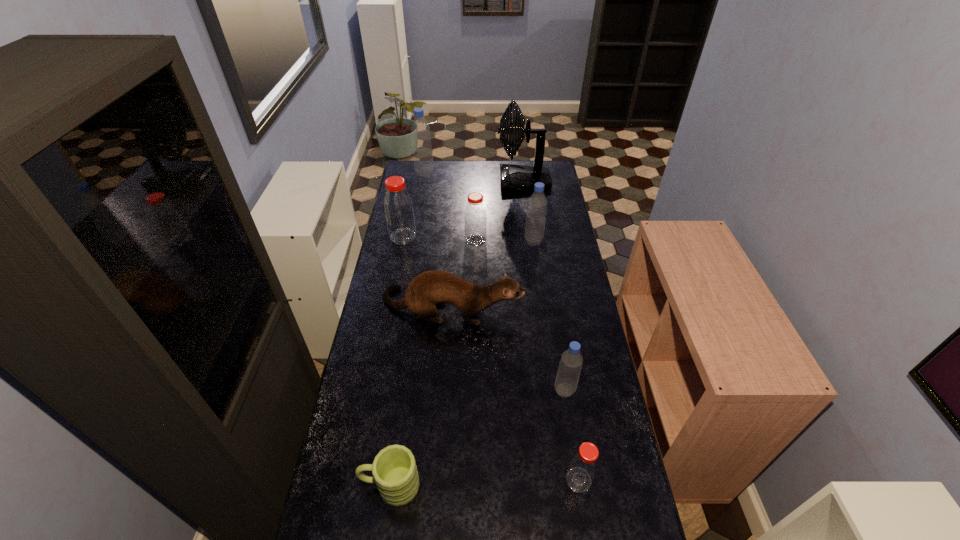
Locate an element on the screen. This screenshot has height=540, width=960. vacant space located on the back of the second farthest blue bottle is located at coordinates (532, 228).

Where is `vacant space situated 0.320m on the right of the second red bottle from right to left`? vacant space situated 0.320m on the right of the second red bottle from right to left is located at coordinates (556, 240).

This screenshot has height=540, width=960. Find the location of `vacant area situated 0.360m on the left of the nearest blue bottle`. vacant area situated 0.360m on the left of the nearest blue bottle is located at coordinates (445, 390).

Locate an element on the screen. vacant space situated 0.130m at the face of the ferret is located at coordinates [x=556, y=307].

Where is `vacant region located on the back of the rightmost red bottle`? The image size is (960, 540). vacant region located on the back of the rightmost red bottle is located at coordinates (567, 408).

Locate an element on the screen. fan positioned at the far edge is located at coordinates (513, 178).

The height and width of the screenshot is (540, 960). Identify the location of bottle located at the far edge. (420, 130).

Identify the location of ferret that is at the left edge. The height and width of the screenshot is (540, 960). (435, 287).

Image resolution: width=960 pixels, height=540 pixels. What are the coordinates of `mug that is at the left edge` in the screenshot? It's located at (394, 469).

Find the location of a particular element. The height and width of the screenshot is (540, 960). fan that is at the right edge is located at coordinates (513, 178).